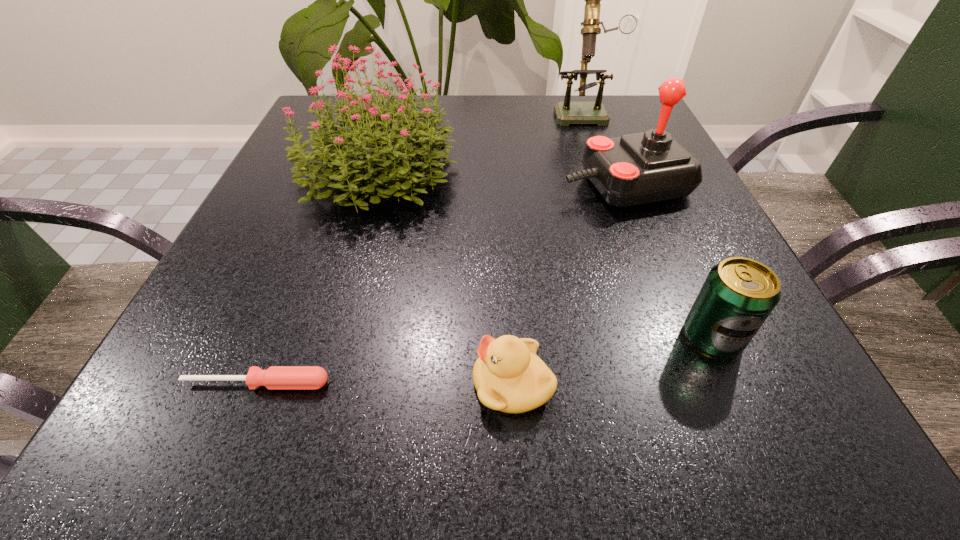
Identify the location of free location located on the left of the joystick. (475, 185).

Locate an element on the screen. Image resolution: width=960 pixels, height=540 pixels. vacant space located 0.210m on the left of the beer can is located at coordinates (532, 338).

Where is `vacant region located 0.110m on the front-facing side of the fourth object from right to left`? The height and width of the screenshot is (540, 960). vacant region located 0.110m on the front-facing side of the fourth object from right to left is located at coordinates (386, 383).

The width and height of the screenshot is (960, 540). I want to click on vacant area situated on the front-facing side of the fourth object from right to left, so click(159, 383).

Find the location of a particular element. The width and height of the screenshot is (960, 540). blank space located on the front-facing side of the fourth object from right to left is located at coordinates (167, 383).

Identify the location of free space located 0.350m on the right of the shortest object. This screenshot has height=540, width=960. (603, 383).

Image resolution: width=960 pixels, height=540 pixels. In order to click on microscope situated at the far edge in this screenshot , I will do `click(567, 112)`.

The height and width of the screenshot is (540, 960). What are the coordinates of `bouquet present at the far edge` in the screenshot? It's located at pyautogui.click(x=402, y=154).

You are a GUI agent. You are given a task and a screenshot of the screen. Output one action in this format:
    pyautogui.click(x=<x>, y=<y>)
    Task: Click on the object positioned at the near edge
    The height and width of the screenshot is (540, 960).
    Given the screenshot: What is the action you would take?
    pyautogui.click(x=508, y=376)

Image resolution: width=960 pixels, height=540 pixels. What are the coordinates of `bouquet that is at the left edge` in the screenshot? It's located at point(402,154).